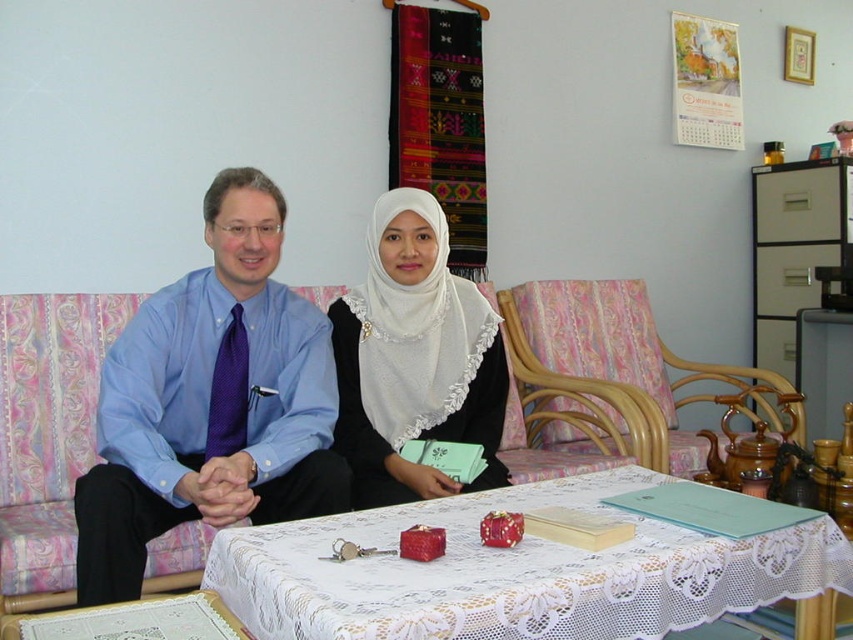
You are standing in the living room and want to hand a document to the person wearing the blue satin shirt at center. The blue fabric armchair at left is blocking your path. Can you walk around the armchair to reach the shirt?

The blue satin shirt at center is closer to the viewer than the blue fabric armchair at left, so you can walk around the armchair to reach the shirt since it is behind the armchair.

You are sitting on the sofa and want to reach the wooden armchair at center. Is the white lace tablecloth at center blocking your path?

The white lace tablecloth at center is closer to the viewer than the wooden armchair at center, so the tablecloth is in front of the armchair. Therefore, the white lace tablecloth at center is blocking the path to the wooden armchair at center.